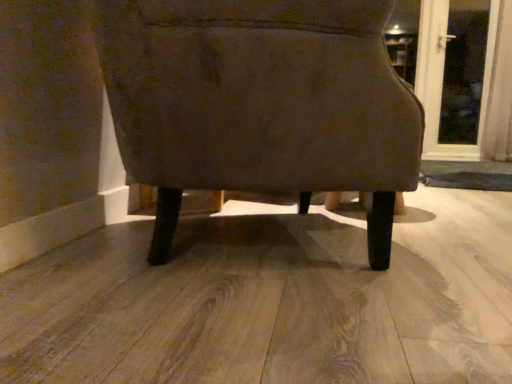
Question: Is transparent glass door at upper right completely or partially outside of suede-like brown chair at center?

Choices:
 (A) no
 (B) yes

Answer: (B)

Question: From the image's perspective, is transparent glass door at upper right below suede-like brown chair at center?

Choices:
 (A) yes
 (B) no

Answer: (B)

Question: Considering the relative sizes of transparent glass door at upper right and suede-like brown chair at center in the image provided, is transparent glass door at upper right bigger than suede-like brown chair at center?

Choices:
 (A) no
 (B) yes

Answer: (A)

Question: Could you tell me if transparent glass door at upper right is turned towards suede-like brown chair at center?

Choices:
 (A) no
 (B) yes

Answer: (A)

Question: Is transparent glass door at upper right further to camera compared to suede-like brown chair at center?

Choices:
 (A) no
 (B) yes

Answer: (B)

Question: Is transparent glass door at upper right wider than suede-like brown chair at center?

Choices:
 (A) yes
 (B) no

Answer: (B)

Question: From the image's perspective, is suede-like brown chair at center under transparent glass door at upper right?

Choices:
 (A) no
 (B) yes

Answer: (B)

Question: Does suede-like brown chair at center appear on the right side of transparent glass door at upper right?

Choices:
 (A) yes
 (B) no

Answer: (B)

Question: Is suede-like brown chair at center positioned before transparent glass door at upper right?

Choices:
 (A) no
 (B) yes

Answer: (B)

Question: Does suede-like brown chair at center have a smaller size compared to transparent glass door at upper right?

Choices:
 (A) no
 (B) yes

Answer: (A)

Question: Is suede-like brown chair at center oriented away from transparent glass door at upper right?

Choices:
 (A) yes
 (B) no

Answer: (B)

Question: From the image's perspective, is suede-like brown chair at center on top of transparent glass door at upper right?

Choices:
 (A) no
 (B) yes

Answer: (A)

Question: Visually, is suede-like brown chair at center positioned to the left or to the right of transparent glass door at upper right?

Choices:
 (A) right
 (B) left

Answer: (B)